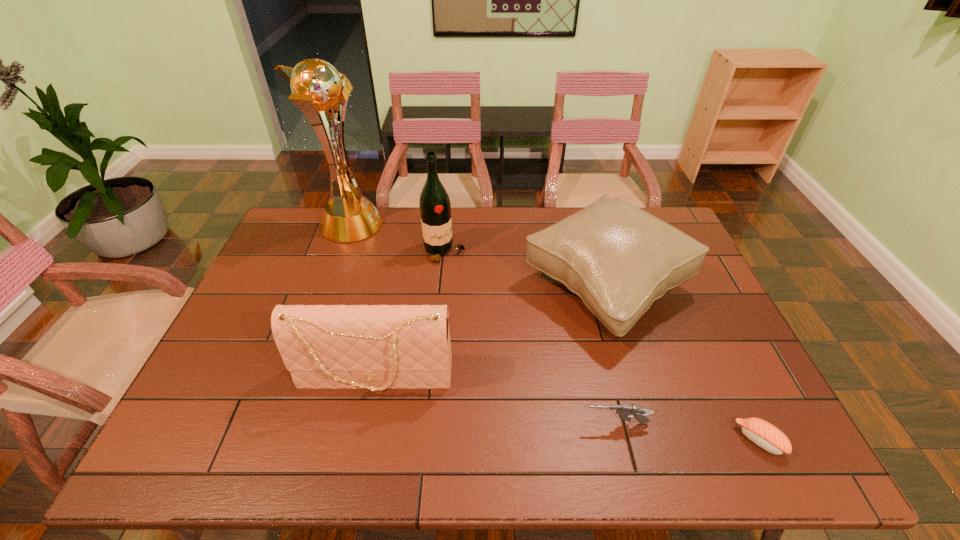
Locate an element on the screen. This screenshot has width=960, height=540. free space located 0.150m at the barrel of the fifth tallest object is located at coordinates (519, 423).

Locate an element on the screen. vacant region located at the barrel of the fifth tallest object is located at coordinates (441, 423).

Where is `vacant space located 0.250m at the barrel of the fifth tallest object`? This screenshot has width=960, height=540. vacant space located 0.250m at the barrel of the fifth tallest object is located at coordinates click(476, 423).

This screenshot has height=540, width=960. I want to click on vacant space located on the back of the sushi, so [x=699, y=316].

Find the location of a particular element. trophy at the far edge is located at coordinates (316, 86).

This screenshot has width=960, height=540. I want to click on wine bottle present at the far edge, so click(435, 209).

You are a GUI agent. You are given a task and a screenshot of the screen. Output one action in this format:
    pyautogui.click(x=<x>, y=<y>)
    Task: Click on the cushion that is at the far edge
    
    Given the screenshot: What is the action you would take?
    pyautogui.click(x=618, y=258)

The width and height of the screenshot is (960, 540). In order to click on object that is at the near edge in this screenshot , I will do [765, 435].

Where is `object that is at the left edge`? Image resolution: width=960 pixels, height=540 pixels. object that is at the left edge is located at coordinates (316, 86).

At what (x,y) coordinates should I click in order to perform the action: click on cushion positioned at the right edge. Please return your answer as a coordinate pair (x, y). Looking at the image, I should click on (618, 258).